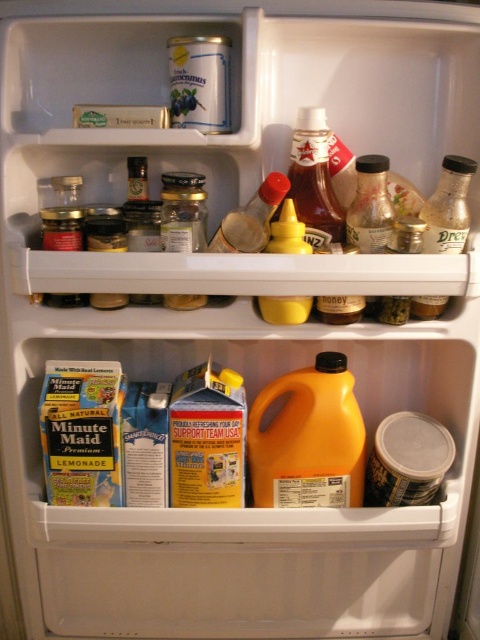
Question: Considering the relative positions of orange matte plastic jug at center and translucent plastic ketchup bottle at upper center in the image provided, where is orange matte plastic jug at center located with respect to translucent plastic ketchup bottle at upper center?

Choices:
 (A) above
 (B) below

Answer: (B)

Question: Can you confirm if translucent plastic ketchup bottle at upper center is positioned to the left of matte glass bottle at center?

Choices:
 (A) no
 (B) yes

Answer: (A)

Question: Which point appears farthest from the camera in this image?

Choices:
 (A) click(286, 202)
 (B) click(376, 248)
 (C) click(324, 156)

Answer: (C)

Question: Which object is the closest to the clear plastic bottle at right?

Choices:
 (A) orange matte plastic jug at center
 (B) matte glass bottle at center

Answer: (B)

Question: Which of the following is the farthest from the observer?

Choices:
 (A) (325, 156)
 (B) (247, 232)

Answer: (A)

Question: Can you confirm if translucent plastic ketchup bottle at upper center is bigger than matte glass bottle at center?

Choices:
 (A) yes
 (B) no

Answer: (B)